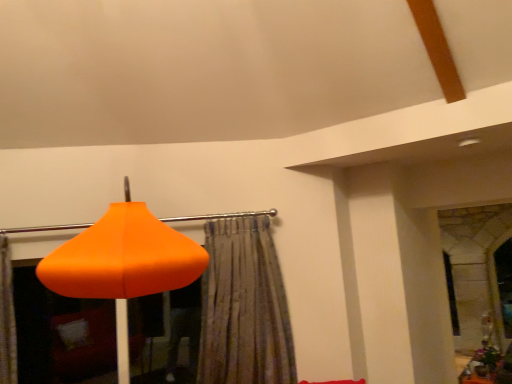
Question: Based on their sizes in the image, would you say wooden textured table at lower right is bigger or smaller than orange matte lampshade at lower left?

Choices:
 (A) small
 (B) big

Answer: (A)

Question: Considering their positions, is wooden textured table at lower right located in front of or behind orange matte lampshade at lower left?

Choices:
 (A) front
 (B) behind

Answer: (B)

Question: Which is farther from the wooden textured table at lower right?

Choices:
 (A) orange matte lampshade at lower left
 (B) textured beige curtain at center

Answer: (A)

Question: Which object is the farthest from the textured beige curtain at center?

Choices:
 (A) orange matte lampshade at lower left
 (B) wooden textured table at lower right

Answer: (B)